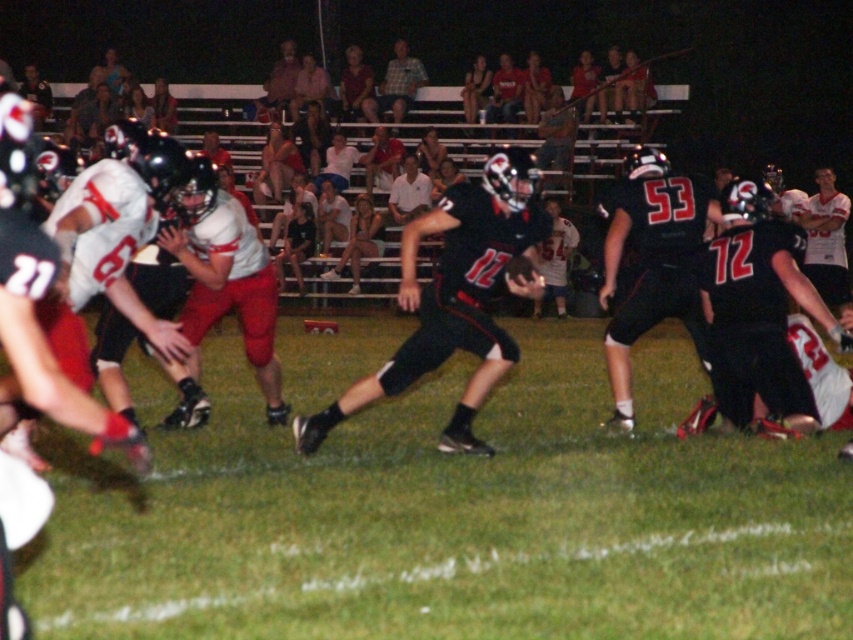
Consider the image. You are a photographer trying to capture a clear shot of the black matte jersey at center and the plaid shirt at upper center. Based on their positions, which one might be easier to frame without overlapping other players?

The plaid shirt at upper center might be easier to frame without overlapping other players since the black matte jersey at center is positioned lower and possibly surrounded by more players.

You are a photographer standing at the edge of the football field. You want to take a photo focusing on the black matte jersey at center and the plaid shirt at upper center. Which one will appear larger in your photo?

The black matte jersey at center will appear larger in the photo because it is closer to the viewer than the plaid shirt at upper center.